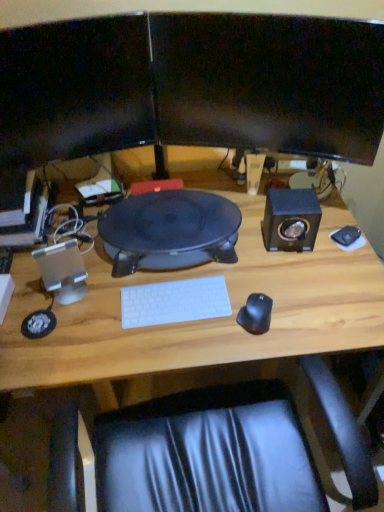
At what (x,y) coordinates should I click in order to perform the action: click on matte black monitor at upper center, the second computer monitor positioned from the right. Please return your answer as a coordinate pair (x, y). The width and height of the screenshot is (384, 512). Looking at the image, I should click on (75, 89).

Identify the location of black matte speaker at right, arranged as the first speaker when viewed from the top. (291, 219).

This screenshot has height=512, width=384. What do you see at coordinates (62, 271) in the screenshot?
I see `silver metallic speaker at left, which is the 2th speaker from right to left` at bounding box center [62, 271].

Image resolution: width=384 pixels, height=512 pixels. Find the location of `matte black monitor at upper center, which appears as the first computer monitor when viewed from the left`. matte black monitor at upper center, which appears as the first computer monitor when viewed from the left is located at coordinates (75, 89).

Looking at this image, would you say wooden desk at center is inside or outside silver metallic speaker at left, arranged as the 2th speaker when viewed from the top?

wooden desk at center is not enclosed by silver metallic speaker at left, arranged as the 2th speaker when viewed from the top.

From the image's perspective, is wooden desk at center on silver metallic speaker at left, which is the 2th speaker from right to left?

No, from the image's perspective, wooden desk at center is not above silver metallic speaker at left, which is the 2th speaker from right to left.

Between point (176, 340) and point (74, 247), which one is positioned in front?

Point (176, 340)

Considering their positions, is wooden desk at center located in front of or behind silver metallic speaker at left, which is the 2th speaker from right to left?

Visually, wooden desk at center is located in front of silver metallic speaker at left, which is the 2th speaker from right to left.

How many degrees apart are the facing directions of matte black monitor at upper center, which appears as the first computer monitor when viewed from the left, and black matte speaker at right, arranged as the first speaker when viewed from the top?

matte black monitor at upper center, which appears as the first computer monitor when viewed from the left, and black matte speaker at right, arranged as the first speaker when viewed from the top, are facing 27 degrees away from each other.

From a real-world perspective, which is physically below, matte black monitor at upper center, the second computer monitor positioned from the right, or black matte speaker at right, which is the 2th speaker from left to right?

black matte speaker at right, which is the 2th speaker from left to right, from a real-world perspective.

From the picture: From the image's perspective, who appears lower, matte black monitor at upper center, the second computer monitor positioned from the right, or black matte speaker at right, arranged as the first speaker when viewed from the top?

black matte speaker at right, arranged as the first speaker when viewed from the top.

Is matte black monitor at upper center, which appears as the first computer monitor when viewed from the left, not inside black matte speaker at right, which is the 2th speaker from left to right?

That's correct, matte black monitor at upper center, which appears as the first computer monitor when viewed from the left, is outside of black matte speaker at right, which is the 2th speaker from left to right.

In terms of width, does matte black monitor at upper center, which appears as the first computer monitor when viewed from the left, look wider or thinner when compared to black glossy monitor at upper center, the second computer monitor viewed from the left?

Clearly, matte black monitor at upper center, which appears as the first computer monitor when viewed from the left, has less width compared to black glossy monitor at upper center, the second computer monitor viewed from the left.

From the image's perspective, which object appears higher, matte black monitor at upper center, the second computer monitor positioned from the right, or black glossy monitor at upper center, marked as the 1th computer monitor in a right-to-left arrangement?

From the image's view, black glossy monitor at upper center, marked as the 1th computer monitor in a right-to-left arrangement, is above.

Can you confirm if matte black monitor at upper center, the second computer monitor positioned from the right, is taller than black glossy monitor at upper center, the second computer monitor viewed from the left?

Indeed, matte black monitor at upper center, the second computer monitor positioned from the right, has a greater height compared to black glossy monitor at upper center, the second computer monitor viewed from the left.

What's the angular difference between matte black monitor at upper center, which appears as the first computer monitor when viewed from the left, and black glossy monitor at upper center, marked as the 1th computer monitor in a right-to-left arrangement,'s facing directions?

The angular difference between matte black monitor at upper center, which appears as the first computer monitor when viewed from the left, and black glossy monitor at upper center, marked as the 1th computer monitor in a right-to-left arrangement, is 39.8 degrees.

Can you tell me how much matte black speaker at center and matte black monitor at upper center, the second computer monitor positioned from the right, differ in facing direction?

21.8 degrees.

Based on the photo, from a real-world perspective, is matte black speaker at center below matte black monitor at upper center, which appears as the first computer monitor when viewed from the left?

Yes, from a real-world perspective, matte black speaker at center is under matte black monitor at upper center, which appears as the first computer monitor when viewed from the left.

Relative to matte black monitor at upper center, the second computer monitor positioned from the right, is matte black speaker at center in front or behind?

Visually, matte black speaker at center is located behind matte black monitor at upper center, the second computer monitor positioned from the right.

Does matte black speaker at center have a lesser width compared to matte black monitor at upper center, which appears as the first computer monitor when viewed from the left?

No, matte black speaker at center is not thinner than matte black monitor at upper center, which appears as the first computer monitor when viewed from the left.

Can you confirm if black rubberized mouse at right, the 1th mouse when ordered from bottom to top, is positioned to the right of white plastic keyboard at center?

Yes.

Is black rubberized mouse at right, the second mouse when ordered from top to bottom, not within white plastic keyboard at center?

Absolutely, black rubberized mouse at right, the second mouse when ordered from top to bottom, is external to white plastic keyboard at center.

Can you confirm if black rubberized mouse at right, the second mouse viewed from the back, is bigger than white plastic keyboard at center?

No.

From a real-world perspective, which is physically above, black glossy monitor at upper center, marked as the 1th computer monitor in a right-to-left arrangement, or wooden desk at center?

black glossy monitor at upper center, marked as the 1th computer monitor in a right-to-left arrangement, from a real-world perspective.

Does black glossy monitor at upper center, marked as the 1th computer monitor in a right-to-left arrangement, come in front of wooden desk at center?

No.

Based on the photo, is black glossy monitor at upper center, marked as the 1th computer monitor in a right-to-left arrangement, touching wooden desk at center?

No.

Considering the positions of objects black matte speaker at right, which is counted as the first speaker, starting from the right, and black matte mouse at right, positioned as the first mouse in top-to-bottom order, in the image provided, who is in front, black matte speaker at right, which is counted as the first speaker, starting from the right, or black matte mouse at right, positioned as the first mouse in top-to-bottom order,?

black matte speaker at right, which is counted as the first speaker, starting from the right.

Is black matte speaker at right, which is the 2th speaker from left to right, to the right of black matte mouse at right, positioned as the first mouse in top-to-bottom order, from the viewer's perspective?

Incorrect, black matte speaker at right, which is the 2th speaker from left to right, is not on the right side of black matte mouse at right, positioned as the first mouse in top-to-bottom order.

Looking at this image, from a real-world perspective, is black matte speaker at right, which is counted as the first speaker, starting from the right, physically located above or below black matte mouse at right, acting as the second mouse starting from the front?

From a real-world perspective, black matte speaker at right, which is counted as the first speaker, starting from the right, is physically above black matte mouse at right, acting as the second mouse starting from the front.

Is black matte speaker at right, which is the 2th speaker from left to right, looking in the opposite direction of black matte mouse at right, positioned as the first mouse in right-to-left order?

black matte speaker at right, which is the 2th speaker from left to right, does not have its back to black matte mouse at right, positioned as the first mouse in right-to-left order.

At what (x,y) coordinates should I click in order to perform the action: click on desk to the right of silver metallic speaker at left, which ranks as the 1th speaker in left-to-right order. Please return your answer as a coordinate pair (x, y). Image resolution: width=384 pixels, height=512 pixels. Looking at the image, I should click on (202, 320).

The image size is (384, 512). Find the location of `the 2nd speaker behind the matte black monitor at upper center, the second computer monitor positioned from the right, counting from the anchor's position`. the 2nd speaker behind the matte black monitor at upper center, the second computer monitor positioned from the right, counting from the anchor's position is located at coordinates (291, 219).

Considering their positions, is matte black monitor at upper center, the second computer monitor positioned from the right, positioned further to black matte speaker at right, which is the 2th speaker from left to right, than wooden desk at center?

Among the two, matte black monitor at upper center, the second computer monitor positioned from the right, is located further to black matte speaker at right, which is the 2th speaker from left to right.

When comparing their distances from metallic silver computer at left, does silver metallic speaker at left, which appears as the 1th speaker when ordered from the bottom, or matte black speaker at center seem closer?

Based on the image, silver metallic speaker at left, which appears as the 1th speaker when ordered from the bottom, appears to be nearer to metallic silver computer at left.

Which object lies nearer to the anchor point matte black monitor at upper center, which appears as the first computer monitor when viewed from the left, black rubberized mouse at right, the 1th mouse when ordered from bottom to top, or metallic silver computer at left?

Among the two, metallic silver computer at left is located nearer to matte black monitor at upper center, which appears as the first computer monitor when viewed from the left.

From the image, which object appears to be farther from metallic silver computer at left, white plastic keyboard at center or silver metallic speaker at left, arranged as the 2th speaker when viewed from the top?

white plastic keyboard at center is further to metallic silver computer at left.

Which object lies further to the anchor point white plastic keyboard at center, black matte mouse at right, the 2th mouse from the bottom, or matte black speaker at center?

black matte mouse at right, the 2th mouse from the bottom, lies further to white plastic keyboard at center than the other object.

From the image, which object appears to be nearer to black glossy monitor at upper center, marked as the 1th computer monitor in a right-to-left arrangement, matte black monitor at upper center, the second computer monitor positioned from the right, or wooden desk at center?

The object closer to black glossy monitor at upper center, marked as the 1th computer monitor in a right-to-left arrangement, is matte black monitor at upper center, the second computer monitor positioned from the right.

Considering their positions, is black glossy monitor at upper center, the second computer monitor viewed from the left, positioned closer to silver metallic speaker at left, arranged as the 2th speaker when viewed from the top, than white plastic keyboard at center?

white plastic keyboard at center lies closer to silver metallic speaker at left, arranged as the 2th speaker when viewed from the top, than the other object.

Consider the image. Which object lies nearer to the anchor point matte black speaker at center, black glossy monitor at upper center, the second computer monitor viewed from the left, or black matte mouse at right, acting as the 1th mouse starting from the back?

black glossy monitor at upper center, the second computer monitor viewed from the left, is positioned closer to the anchor matte black speaker at center.

This screenshot has width=384, height=512. I want to click on stereo situated between silver metallic speaker at left, arranged as the 2th speaker when viewed from the top, and black matte mouse at right, placed as the 2th mouse when sorted from left to right, from left to right, so click(x=169, y=230).

Find the location of a particular element. computer keyboard situated between metallic silver computer at left and black rubberized mouse at right, the 1th mouse when ordered from bottom to top, from left to right is located at coordinates (174, 302).

Where is `stereo between wooden desk at center and black matte speaker at right, arranged as the second speaker when ordered from the bottom, from front to back`? The width and height of the screenshot is (384, 512). stereo between wooden desk at center and black matte speaker at right, arranged as the second speaker when ordered from the bottom, from front to back is located at coordinates (169, 230).

Image resolution: width=384 pixels, height=512 pixels. I want to click on computer keyboard positioned between wooden desk at center and metallic silver computer at left from near to far, so click(174, 302).